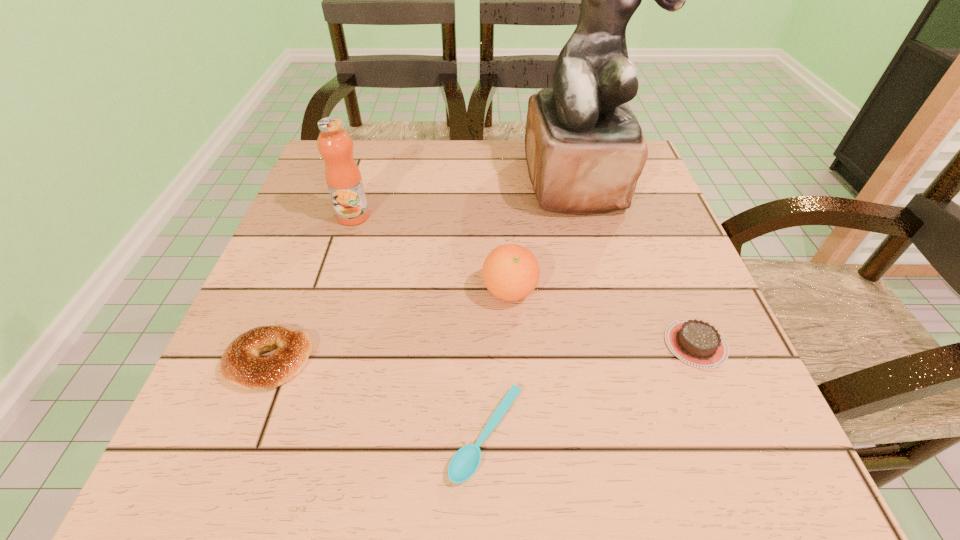
This screenshot has width=960, height=540. What are the coordinates of `free location at the far edge` in the screenshot? It's located at (426, 170).

Find the location of a particular element. This screenshot has width=960, height=540. free spot at the near edge of the desktop is located at coordinates (496, 463).

Find the location of `vacant space at the left edge`. vacant space at the left edge is located at coordinates (280, 242).

You are a GUI agent. You are given a task and a screenshot of the screen. Output one action in this format:
    pyautogui.click(x=<x>, y=<y>)
    Task: Click on the free space at the right edge of the desktop
    Image resolution: width=960 pixels, height=540 pixels.
    Given the screenshot: What is the action you would take?
    pyautogui.click(x=630, y=239)

The width and height of the screenshot is (960, 540). What are the coordinates of `vacant space at the far left corner` in the screenshot? It's located at (361, 141).

Where is `vacant space at the near left corner of the desktop`? The width and height of the screenshot is (960, 540). vacant space at the near left corner of the desktop is located at coordinates (211, 433).

In the image, there is a desktop. At what (x,y) coordinates should I click in order to perform the action: click on free space at the near right corner. Please return your answer as a coordinate pair (x, y). The image size is (960, 540). Looking at the image, I should click on (778, 444).

The image size is (960, 540). What are the coordinates of `free spot between the chocolate cake and the fourth tallest object` in the screenshot? It's located at (483, 353).

You are a GUI agent. You are given a task and a screenshot of the screen. Output one action in this format:
    pyautogui.click(x=<x>, y=<y>)
    Task: Click on the vacant area between the fifth shortest object and the tallest object
    
    Given the screenshot: What is the action you would take?
    pyautogui.click(x=466, y=199)

Where is `free area in between the sculpture and the second shortest object`? The height and width of the screenshot is (540, 960). free area in between the sculpture and the second shortest object is located at coordinates (637, 262).